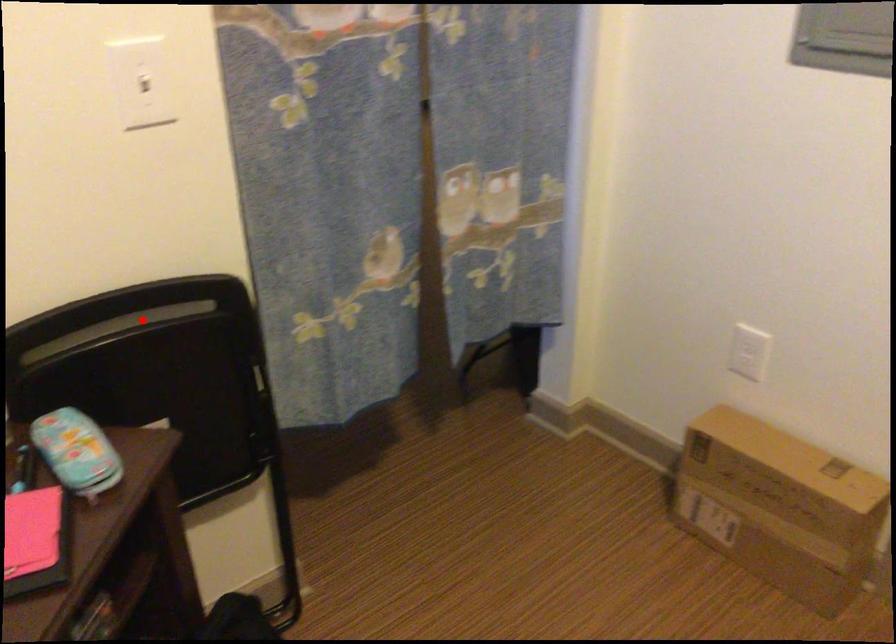
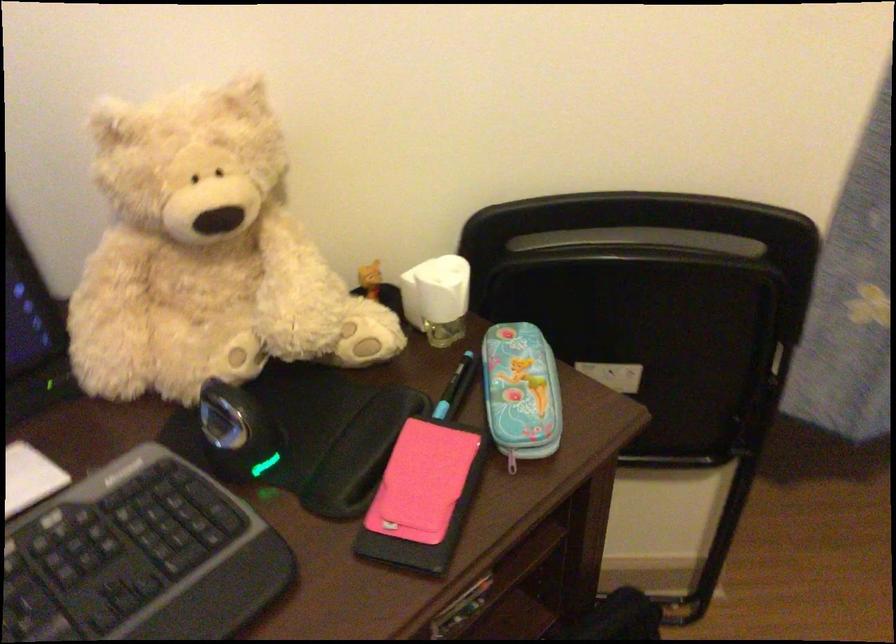
Question: I am providing you with two images of the same scene from different viewpoints. In image1, a red point is highlighted. Considering the same 3D point in image2, which of the following is correct?

Choices:
 (A) It is closer
 (B) It is farther

Answer: (A)